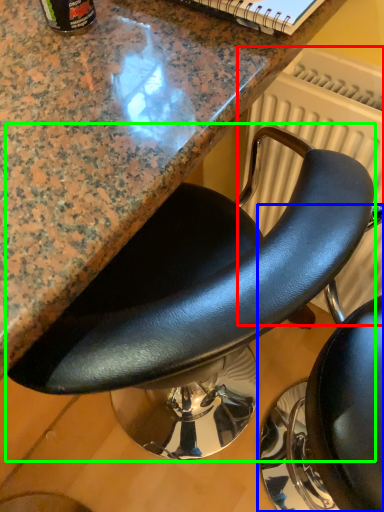
Question: Which object is positioned farthest from radiator (highlighted by a red box)? Select from chair (highlighted by a blue box) and chair (highlighted by a green box).

Choices:
 (A) chair
 (B) chair

Answer: (A)